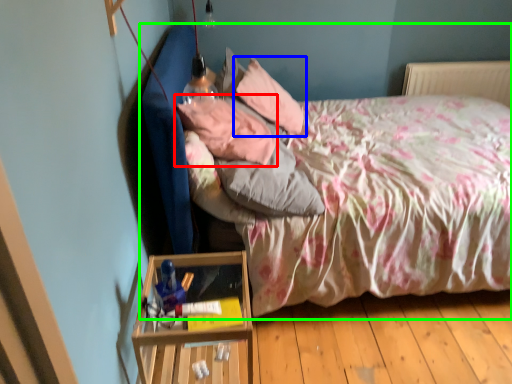
Question: Which is farther away from pillow (highlighted by a red box)? pillow (highlighted by a blue box) or bed (highlighted by a green box)?

Choices:
 (A) pillow
 (B) bed

Answer: (B)